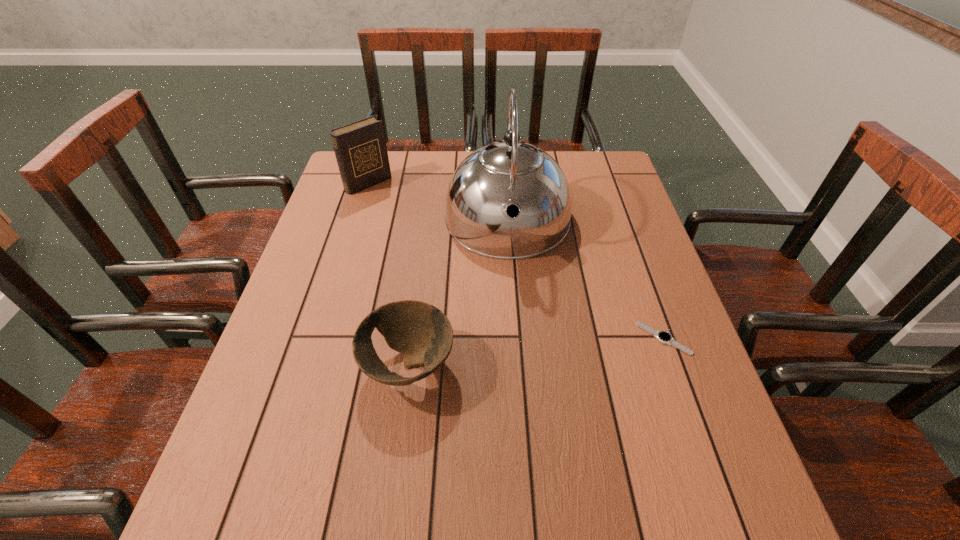
Where is `bowl`? bowl is located at coordinates (422, 333).

Image resolution: width=960 pixels, height=540 pixels. I want to click on the shortest object, so click(664, 337).

What are the coordinates of `watch` in the screenshot? It's located at (664, 337).

Locate an element on the screen. the tallest object is located at coordinates (511, 175).

I want to click on diary, so 360,148.

Locate an element on the screen. The image size is (960, 540). the third shortest object is located at coordinates (360, 148).

Identify the location of vacant region located 0.070m on the right of the third tallest object. The image size is (960, 540). (489, 366).

At what (x,y) coordinates should I click in order to perform the action: click on vacant area situated on the front of the rightmost object. Please return your answer as a coordinate pair (x, y). The image size is (960, 540). Looking at the image, I should click on (693, 422).

Find the location of a particular element. The image size is (960, 540). vacant space situated 0.090m from the spout of the kettle is located at coordinates (511, 296).

You are a GUI agent. You are given a task and a screenshot of the screen. Output one action in this format:
    pyautogui.click(x=<x>, y=<y>)
    Task: Click on the vacant region located from the spout of the kettle
    The image size is (960, 540).
    Given the screenshot: What is the action you would take?
    pyautogui.click(x=516, y=408)